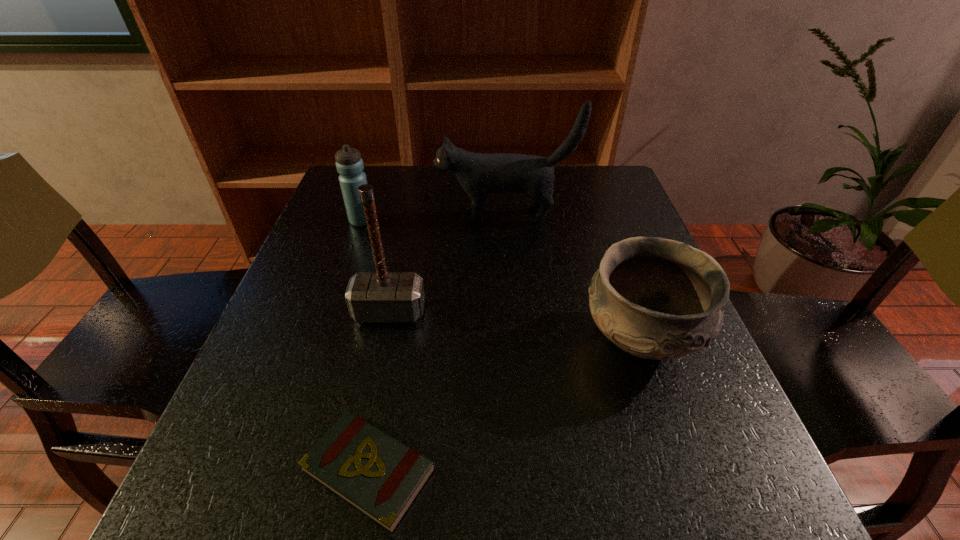
Identify the location of cat. (479, 174).

The width and height of the screenshot is (960, 540). I want to click on hammer, so click(x=381, y=296).

Identify the location of water bottle. (349, 164).

This screenshot has height=540, width=960. In order to click on the leftmost object in this screenshot , I will do `click(349, 164)`.

Locate an element on the screen. the fourth tallest object is located at coordinates (655, 298).

I want to click on the nearest object, so click(379, 476).

Locate an element on the screen. The image size is (960, 540). the shortest object is located at coordinates (379, 476).

In order to click on vacant space situated at the face of the cat in this screenshot , I will do 326,216.

The width and height of the screenshot is (960, 540). I want to click on free region located 0.090m at the face of the cat, so click(x=402, y=216).

Where is `vacant space located at the face of the cat`? The height and width of the screenshot is (540, 960). vacant space located at the face of the cat is located at coordinates (374, 216).